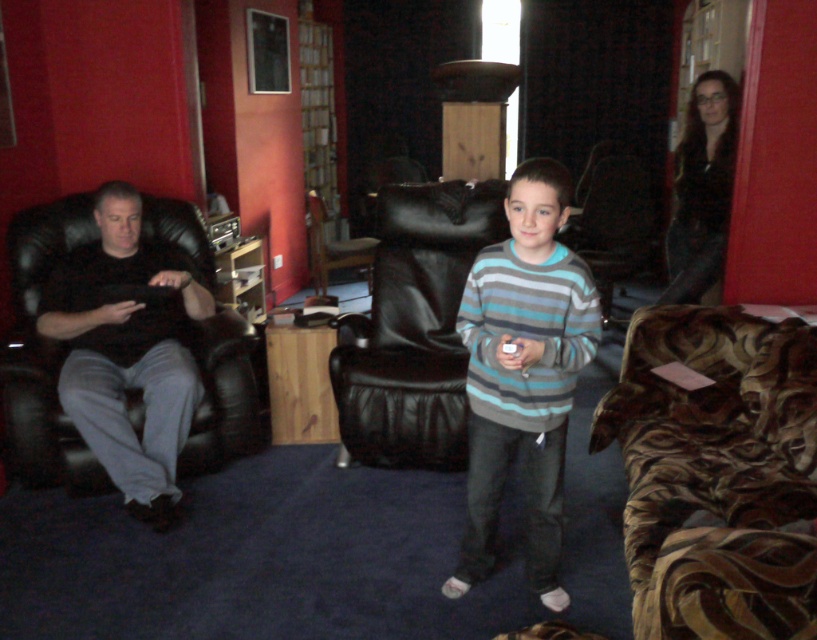
You are standing in the living room and want to place a small plant between the two points, point (106, 337) and point (362, 241). Which point should the plant be closer to in order to be nearer to the viewer?

The plant should be closer to point (106, 337) because it is nearer to the viewer compared to point (362, 241).

You are planning to host a movie night and want to seat as many guests as possible. Given the brown velvety couch at lower right and the black leather armchair at center, which furniture should you choose to accommodate more people?

The brown velvety couch at lower right has a larger width than the black leather armchair at center, so it can accommodate more people.

You are standing in the living room and want to sit down on the brown velvety couch at lower right. According to the coordinates provided, in which direction should you move from your current position to reach it?

The brown velvety couch at lower right is located at coordinates point (717, 474). Since the coordinates are given as x,y, moving towards the lower right direction would lead you to the couch.